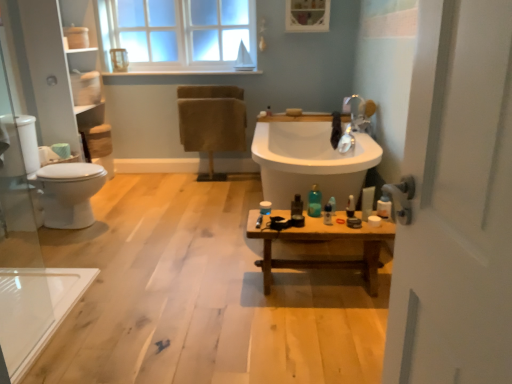
This screenshot has width=512, height=384. What do you see at coordinates (331, 205) in the screenshot? I see `translucent plastic bottle at right, placed as the fourth toiletry when sorted from left to right` at bounding box center [331, 205].

Describe the element at coordinates (384, 206) in the screenshot. I see `translucent plastic bottle at right, which is the sixth toiletry from left to right` at that location.

You are a GUI agent. You are given a task and a screenshot of the screen. Output one action in this format:
    pyautogui.click(x=<x>, y=<y>)
    Task: Click on the clear glass window at upper center
    
    Given the screenshot: What is the action you would take?
    pyautogui.click(x=177, y=33)

Where is `translucent plastic bottle at center, which is the 6th toiletry in right-to-left order`? Image resolution: width=512 pixels, height=384 pixels. translucent plastic bottle at center, which is the 6th toiletry in right-to-left order is located at coordinates (297, 206).

Describe the element at coordinates (212, 122) in the screenshot. This screenshot has height=384, width=512. I see `beige fabric chair at upper center` at that location.

You are a GUI agent. You are given a task and a screenshot of the screen. Output one action in this format:
    pyautogui.click(x=<x>, y=<y>)
    Task: Click on the wooden bench at center
    
    Given the screenshot: What is the action you would take?
    pyautogui.click(x=295, y=117)

From the picture: Can you confirm if beige fabric chair at upper center is shorter than translucent plastic bottle at right, which is the sixth toiletry from left to right?

No.

Based on the photo, does beige fabric chair at upper center have a greater width compared to translucent plastic bottle at right, which is the sixth toiletry from left to right?

Indeed, beige fabric chair at upper center has a greater width compared to translucent plastic bottle at right, which is the sixth toiletry from left to right.

From a real-world perspective, is beige fabric chair at upper center above or below translucent plastic bottle at right, which is the sixth toiletry from left to right?

beige fabric chair at upper center is above translucent plastic bottle at right, which is the sixth toiletry from left to right.

Are beige fabric chair at upper center and translucent plastic bottle at right, which is the sixth toiletry from left to right, far apart?

Yes, beige fabric chair at upper center is far from translucent plastic bottle at right, which is the sixth toiletry from left to right.

Considering the positions of point (211, 106) and point (376, 290), is point (211, 106) closer or farther from the camera than point (376, 290)?

Point (211, 106) appears to be farther away from the viewer than point (376, 290).

Is beige fabric chair at upper center in front of or behind wooden bench at center in the image?

Visually, beige fabric chair at upper center is located behind wooden bench at center.

Is wooden bench at center at the back of beige fabric chair at upper center?

No.

Is beige fabric chair at upper center positioned far away from wooden bench at center?

Yes.

Between wooden bench at center and beige fabric chair at upper center, which one appears on the left side from the viewer's perspective?

beige fabric chair at upper center.

Does point (162, 202) come in front of point (208, 99)?

Yes, it is in front of point (208, 99).

Is wooden bench at center situated inside beige fabric chair at upper center or outside?

wooden bench at center is outside beige fabric chair at upper center.

Measure the distance from wooden bench at center to beige fabric chair at upper center.

wooden bench at center is 4.51 feet from beige fabric chair at upper center.

Is point (324, 216) positioned behind point (212, 136)?

No, it is in front of (212, 136).

Which is more to the right, translucent plastic bottle at center, the third toiletry viewed from the left, or beige fabric chair at upper center?

From the viewer's perspective, translucent plastic bottle at center, the third toiletry viewed from the left, appears more on the right side.

Is beige fabric chair at upper center oriented away from white matte toilet paper at lower left?

That's not correct — beige fabric chair at upper center is not looking away from white matte toilet paper at lower left.

From a real-world perspective, who is located lower, beige fabric chair at upper center or white matte toilet paper at lower left?

white matte toilet paper at lower left.

In the image, there is a white matte toilet paper at lower left. Where is `chair above it (from the image's perspective)`? Image resolution: width=512 pixels, height=384 pixels. chair above it (from the image's perspective) is located at coordinates (212, 122).

Does point (148, 221) appear closer or farther from the camera than point (331, 199)?

Point (148, 221) is positioned farther from the camera compared to point (331, 199).

Between wooden bench at center and translucent plastic bottle at right, placed as the fourth toiletry when sorted from left to right, which one has smaller width?

translucent plastic bottle at right, placed as the fourth toiletry when sorted from left to right.

This screenshot has height=384, width=512. Identify the location of plain lying on the left of translucent plastic bottle at right, arranged as the 3th toiletry when viewed from the right. (202, 296).

Between wooden bench at center and translucent plastic bottle at right, arranged as the 3th toiletry when viewed from the right, which one has larger size?

Bigger between the two is wooden bench at center.

Is translucent plastic bottle at center, the third toiletry viewed from the left, beside translucent plastic bottle at right, which is the sixth toiletry from left to right?

No, translucent plastic bottle at center, the third toiletry viewed from the left, is not next to translucent plastic bottle at right, which is the sixth toiletry from left to right.

Can you confirm if translucent plastic bottle at center, the third toiletry viewed from the left, is wider than translucent plastic bottle at right, marked as the 1th toiletry in a right-to-left arrangement?

Yes, translucent plastic bottle at center, the third toiletry viewed from the left, is wider than translucent plastic bottle at right, marked as the 1th toiletry in a right-to-left arrangement.

Which toiletry is the 3rd one when counting from the right side of the translucent plastic bottle at center, which is counted as the fourth toiletry, starting from the right? Please provide its 2D coordinates.

[(384, 206)]

I want to click on toiletry that is the 5th object located in front of the beige fabric chair at upper center, so click(x=384, y=206).

Identify the location of chair on the left of wooden bench at center. This screenshot has width=512, height=384. (x=212, y=122).

Which object lies further to the anchor point translucent plastic bottle at center, positioned as the 1th toiletry in left-to-right order, wooden bench at center or beige fabric chair at upper center?

Among the two, beige fabric chair at upper center is located further to translucent plastic bottle at center, positioned as the 1th toiletry in left-to-right order.

Considering their positions, is clear glass window at upper center positioned further to white matte toilet paper at lower left than translucent plastic bottle at right, placed as the fourth toiletry when sorted from left to right?

The object further to white matte toilet paper at lower left is clear glass window at upper center.

Considering their positions, is beige fabric chair at upper center positioned further to translucent plastic bottle at center, the fifth toiletry when ordered from right to left, than translucent plastic bottle at center, the third toiletry viewed from the left?

Among the two, beige fabric chair at upper center is located further to translucent plastic bottle at center, the fifth toiletry when ordered from right to left.

Looking at the image, which one is located closer to translucent plastic bottle at center, which is the 6th toiletry in right-to-left order, transparent glass door at left or white matte toilet paper at lower left?

white matte toilet paper at lower left is positioned closer to the anchor translucent plastic bottle at center, which is the 6th toiletry in right-to-left order.

Based on their spatial positions, is transparent glass door at left or translucent plastic bottle at center, which is the 6th toiletry in right-to-left order, further from clear glass window at upper center?

translucent plastic bottle at center, which is the 6th toiletry in right-to-left order, is further to clear glass window at upper center.

Considering their positions, is translucent plastic bottle at right, placed as the fourth toiletry when sorted from left to right, positioned closer to translucent plastic bottle at right, marked as the 1th toiletry in a right-to-left arrangement, than translucent plastic bottle at right, acting as the 2th toiletry starting from the right?

translucent plastic bottle at right, acting as the 2th toiletry starting from the right, is closer to translucent plastic bottle at right, marked as the 1th toiletry in a right-to-left arrangement.

Considering their positions, is white glossy toilet at left positioned closer to translucent plastic bottle at center, the fifth toiletry when ordered from right to left, than translucent plastic bottle at right, marked as the 1th toiletry in a right-to-left arrangement?

Based on the image, translucent plastic bottle at right, marked as the 1th toiletry in a right-to-left arrangement, appears to be nearer to translucent plastic bottle at center, the fifth toiletry when ordered from right to left.

Based on their spatial positions, is wooden bench at center or wooden bench at center further from translucent plastic bottle at right, which is the 5th toiletry from left to right?

wooden bench at center.

Find the location of a particular element. counter top located between transparent glass door at left and clear glass window at upper center in the depth direction is located at coordinates (295, 117).

Locate an element on the screen. This screenshot has width=512, height=384. table between white glossy toilet at left and white matte toilet paper at lower left in the horizontal direction is located at coordinates (324, 245).

You are a GUI agent. You are given a task and a screenshot of the screen. Output one action in this format:
    pyautogui.click(x=<x>, y=<y>)
    Task: Click on the chair between white glossy toilet at left and wooden bench at center in the horizontal direction
    
    Given the screenshot: What is the action you would take?
    pyautogui.click(x=212, y=122)

Find the location of a particular element. This screenshot has height=384, width=512. counter top between translucent plastic bottle at center, positioned as the 1th toiletry in left-to-right order, and beige fabric chair at upper center in the front-back direction is located at coordinates (295, 117).